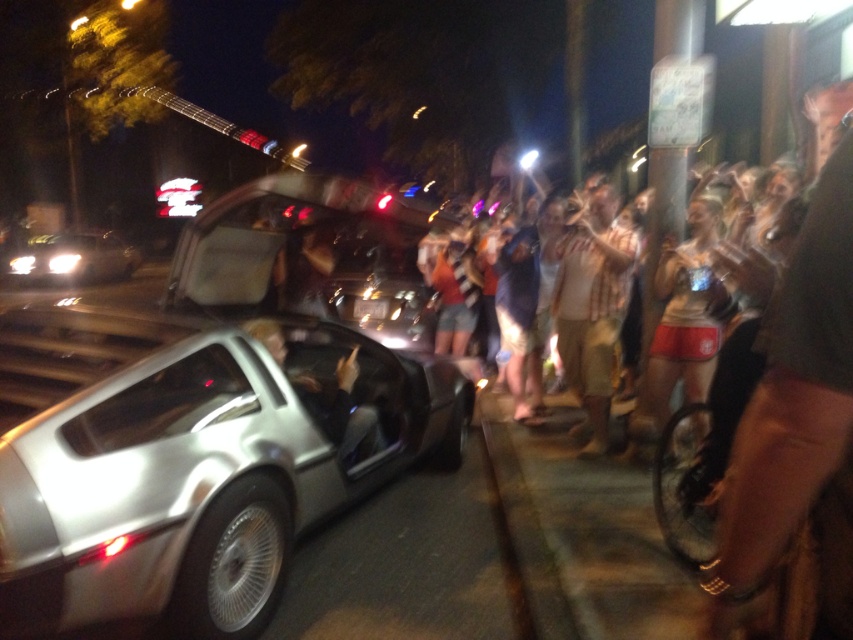
Question: Estimate the real-world distances between objects in this image. Which object is farther from the white cotton shirt at center?

Choices:
 (A) matte white tank tops at center
 (B) silver metallic delorean at center

Answer: (B)

Question: Can you confirm if matte white tank tops at center is wider than metallic silver car door at center?

Choices:
 (A) no
 (B) yes

Answer: (A)

Question: Observing the image, what is the correct spatial positioning of metallic silver shorts at center right in reference to metallic silver car door at center?

Choices:
 (A) left
 (B) right

Answer: (B)

Question: Can you confirm if silver metallic delorean at center is smaller than white cotton shirt at center?

Choices:
 (A) no
 (B) yes

Answer: (A)

Question: Among these points, which one is farthest from the camera?

Choices:
 (A) (360, 433)
 (B) (151, 476)

Answer: (A)

Question: Among these points, which one is farthest from the camera?

Choices:
 (A) (703, 246)
 (B) (306, 396)
 (C) (335, 440)
 (D) (26, 260)

Answer: (D)